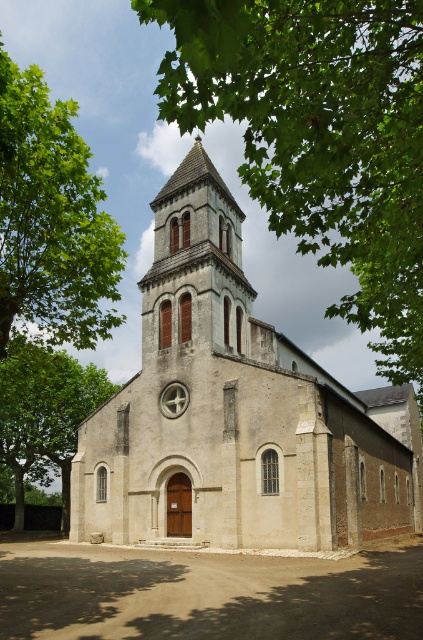
Can you confirm if beige stone church at center is taller than green leafy tree at upper center?

In fact, beige stone church at center may be shorter than green leafy tree at upper center.

Who is higher up, beige stone church at center or green leafy tree at upper center?

green leafy tree at upper center is above.

Identify the location of beige stone church at center. Image resolution: width=423 pixels, height=640 pixels. (236, 412).

Find the location of a particular element. The height and width of the screenshot is (640, 423). beige stone church at center is located at coordinates (236, 412).

Is point (313, 401) positioned after point (244, 330)?

No, (313, 401) is in front of (244, 330).

Can you confirm if beige stone church at center is positioned to the left of smooth stone spire at center?

In fact, beige stone church at center is to the right of smooth stone spire at center.

Does point (161, 492) come in front of point (214, 310)?

Yes, point (161, 492) is in front of point (214, 310).

Locate an element on the screen. The height and width of the screenshot is (640, 423). beige stone church at center is located at coordinates coord(236,412).

What do you see at coordinates (318, 136) in the screenshot? The image size is (423, 640). I see `green leafy tree at upper center` at bounding box center [318, 136].

From the picture: Between green leafy tree at upper center and green leafy tree at lower left, which one is positioned lower?

green leafy tree at lower left is below.

Does point (349, 257) come farther from viewer compared to point (14, 429)?

No.

Identify the location of green leafy tree at upper center. (318, 136).